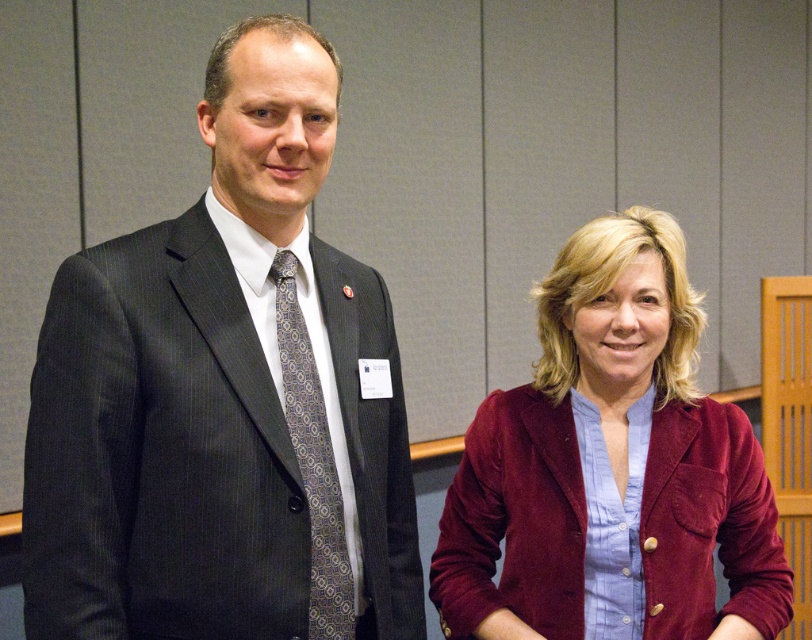
Does velvet maroon blazer at lower right have a greater height compared to patterned silk tie at center?

Yes, velvet maroon blazer at lower right is taller than patterned silk tie at center.

Between velvet maroon blazer at lower right and patterned silk tie at center, which one has more height?

velvet maroon blazer at lower right

Is point (443, 600) more distant than point (339, 586)?

Yes, point (443, 600) is farther from viewer.

At what (x,y) coordinates should I click in order to perform the action: click on velvet maroon blazer at lower right. Please return your answer as a coordinate pair (x, y). Looking at the image, I should click on (610, 467).

Is point (253, 534) behind point (752, 464)?

No, (253, 534) is closer to viewer.

Does matte black suit at left appear under velvet maroon blazer at lower right?

Actually, matte black suit at left is above velvet maroon blazer at lower right.

Does point (266, 189) come behind point (655, 289)?

That is False.

Find the location of a particular element. The height and width of the screenshot is (640, 812). matte black suit at left is located at coordinates (223, 397).

Can you confirm if matte black suit at left is taller than patterned silk tie at center?

Indeed, matte black suit at left has a greater height compared to patterned silk tie at center.

Does matte black suit at left appear on the right side of patterned silk tie at center?

Incorrect, matte black suit at left is not on the right side of patterned silk tie at center.

Where is `matte black suit at left`? The width and height of the screenshot is (812, 640). matte black suit at left is located at coordinates (223, 397).